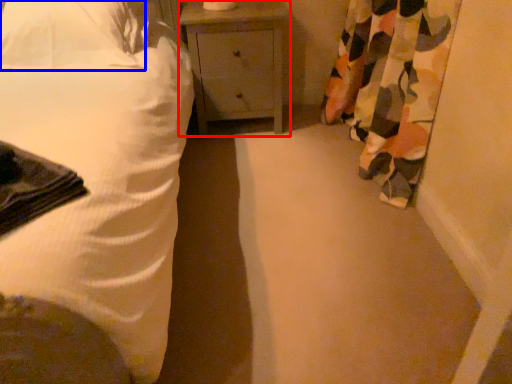
Question: Which object appears closest to the camera in this image, nightstand (highlighted by a red box) or pillow (highlighted by a blue box)?

Choices:
 (A) nightstand
 (B) pillow

Answer: (B)